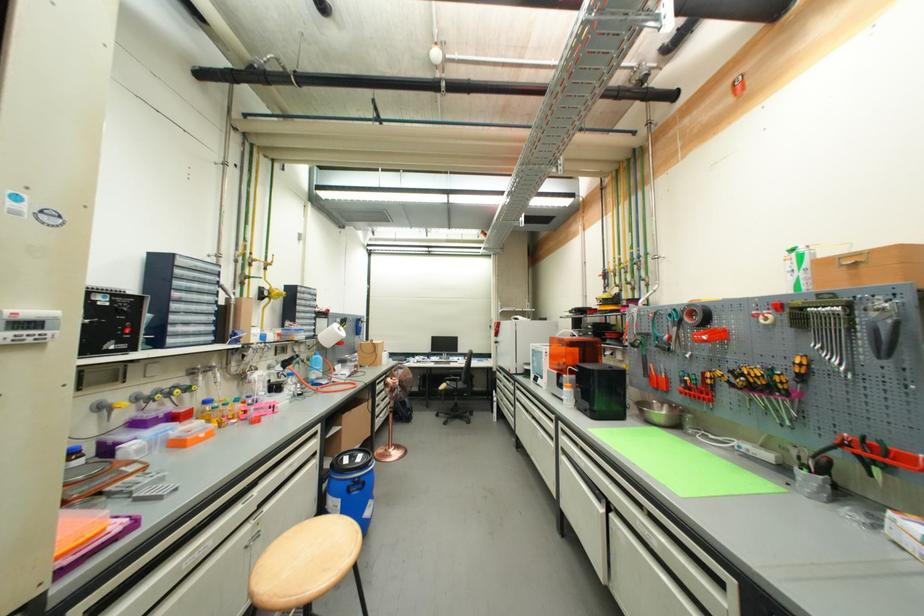
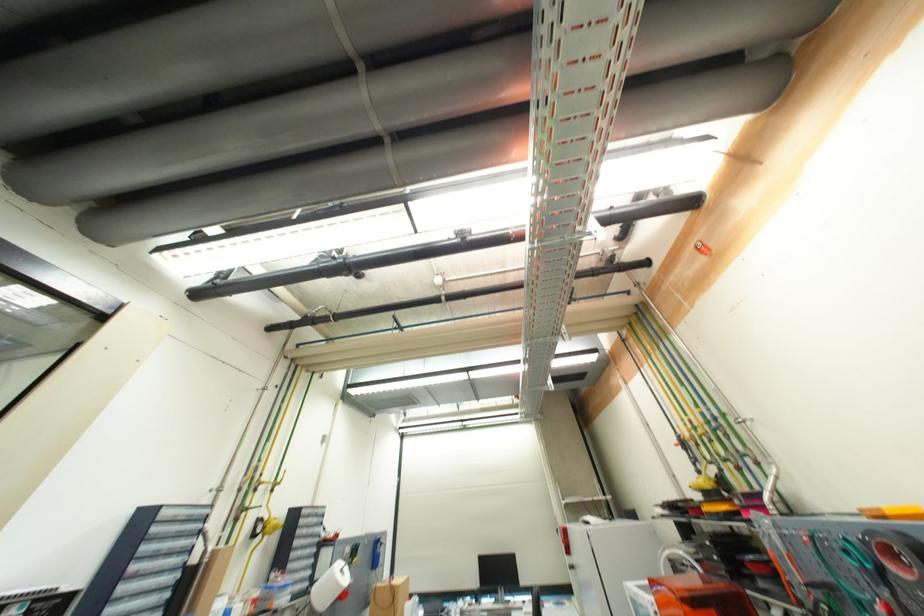
Question: The first image is from the beginning of the video and the second image is from the end. How did the camera likely rotate when shooting the video?

Choices:
 (A) Left
 (B) Right
 (C) Up
 (D) Down

Answer: (C)